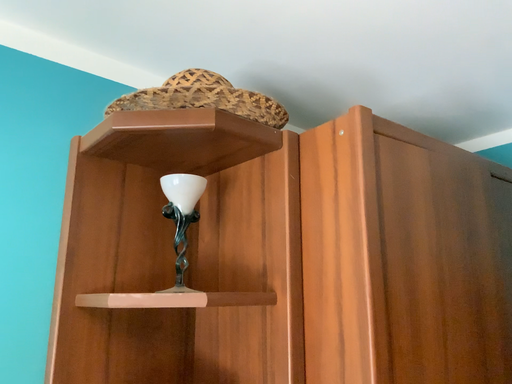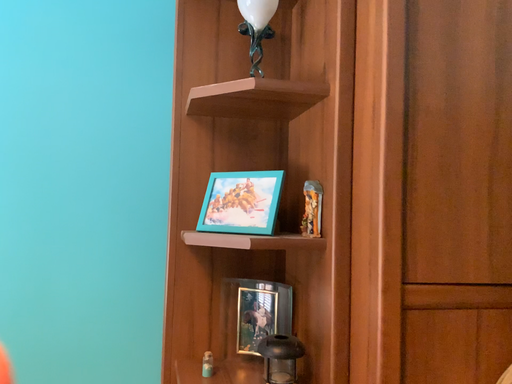
Question: Which way did the camera rotate in the video?

Choices:
 (A) rotated right
 (B) rotated left

Answer: (B)